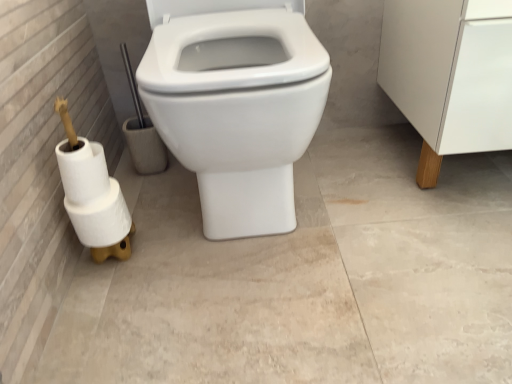
Question: From a real-world perspective, is white matte toilet paper at lower left, the third toilet paper from the top, positioned over white matte toilet paper at lower left, placed as the first toilet paper when sorted from top to bottom, based on gravity?

Choices:
 (A) no
 (B) yes

Answer: (A)

Question: From the image's perspective, does white matte toilet paper at lower left, the third toilet paper from the top, appear higher than white matte toilet paper at lower left, placed as the first toilet paper when sorted from top to bottom?

Choices:
 (A) yes
 (B) no

Answer: (B)

Question: Does white matte toilet paper at lower left, the third toilet paper from the top, have a lesser width compared to white matte toilet paper at lower left, placed as the first toilet paper when sorted from top to bottom?

Choices:
 (A) no
 (B) yes

Answer: (A)

Question: Considering the relative positions of white matte toilet paper at lower left, the 1th toilet paper ordered from the bottom, and white matte toilet paper at lower left, placed as the first toilet paper when sorted from top to bottom, in the image provided, is white matte toilet paper at lower left, the 1th toilet paper ordered from the bottom, to the left of white matte toilet paper at lower left, placed as the first toilet paper when sorted from top to bottom, from the viewer's perspective?

Choices:
 (A) yes
 (B) no

Answer: (B)

Question: From a real-world perspective, is white matte toilet paper at lower left, the 1th toilet paper ordered from the bottom, positioned under white matte toilet paper at lower left, placed as the first toilet paper when sorted from top to bottom, based on gravity?

Choices:
 (A) no
 (B) yes

Answer: (B)

Question: Are white matte toilet paper at lower left, the 1th toilet paper ordered from the bottom, and white matte toilet paper at lower left, placed as the first toilet paper when sorted from top to bottom, located far from each other?

Choices:
 (A) no
 (B) yes

Answer: (A)

Question: Could you tell me if white glossy toilet at center is turned towards white matte toilet paper at lower left, the third toilet paper from the top?

Choices:
 (A) no
 (B) yes

Answer: (A)

Question: From the image's perspective, is white glossy toilet at center above white matte toilet paper at lower left, the third toilet paper from the top?

Choices:
 (A) yes
 (B) no

Answer: (A)

Question: Is white glossy toilet at center smaller than white matte toilet paper at lower left, the 1th toilet paper ordered from the bottom?

Choices:
 (A) yes
 (B) no

Answer: (B)

Question: Does white glossy toilet at center lie behind white matte toilet paper at lower left, the third toilet paper from the top?

Choices:
 (A) yes
 (B) no

Answer: (B)

Question: Is white glossy toilet at center positioned far away from white matte toilet paper at lower left, the third toilet paper from the top?

Choices:
 (A) no
 (B) yes

Answer: (A)

Question: Does white glossy toilet at center appear on the right side of white matte toilet paper at lower left, the 1th toilet paper ordered from the bottom?

Choices:
 (A) no
 (B) yes

Answer: (B)

Question: Is white matte toilet paper at lower left, the third toilet paper from the top, positioned with its back to white wood cabinet leg at right?

Choices:
 (A) no
 (B) yes

Answer: (A)